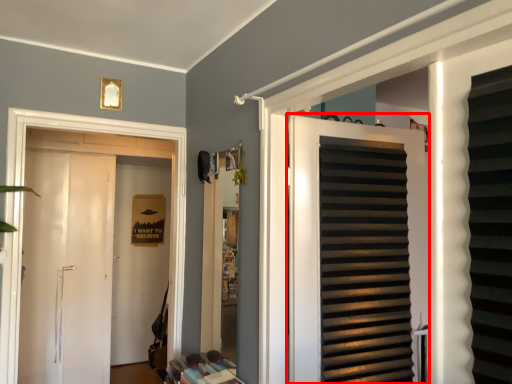
Question: From the image's perspective, what is the correct spatial relationship of door (annotated by the red box) in relation to door?

Choices:
 (A) below
 (B) above

Answer: (B)